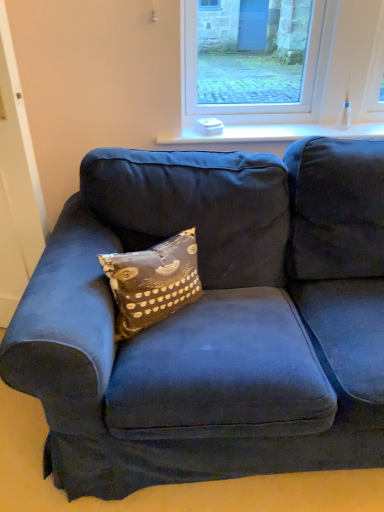
Question: Considering the positions of clear glass window at upper center and brown printed cushion at center in the image, is clear glass window at upper center bigger or smaller than brown printed cushion at center?

Choices:
 (A) big
 (B) small

Answer: (A)

Question: From a real-world perspective, relative to brown printed cushion at center, is clear glass window at upper center vertically above or below?

Choices:
 (A) above
 (B) below

Answer: (A)

Question: Estimate the real-world distances between objects in this image. Which object is farther from the white glossy window sill at upper center?

Choices:
 (A) brown printed cushion at center
 (B) clear glass window at upper center

Answer: (A)

Question: Which object is the closest to the brown printed cushion at center?

Choices:
 (A) clear glass window at upper center
 (B) white glossy window sill at upper center

Answer: (B)